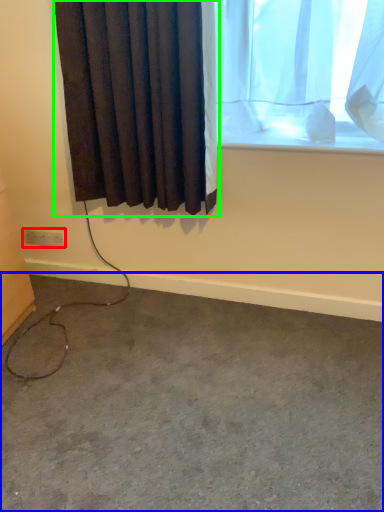
Question: Which object is positioned farthest from electric outlet (highlighted by a red box)? Select from concrete (highlighted by a blue box) and curtain (highlighted by a green box).

Choices:
 (A) concrete
 (B) curtain

Answer: (A)